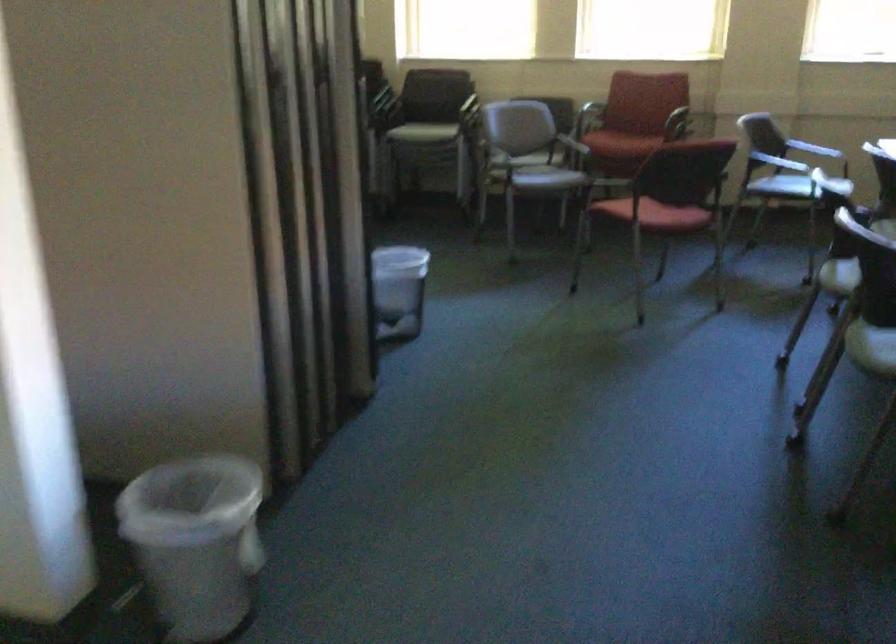
The height and width of the screenshot is (644, 896). What do you see at coordinates (675, 124) in the screenshot?
I see `the red chair armrest` at bounding box center [675, 124].